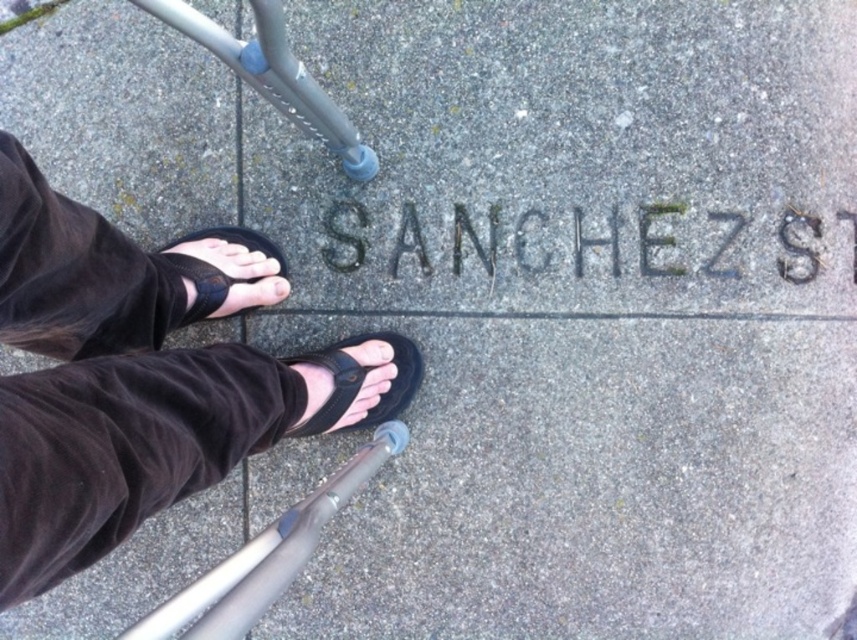
Which is behind, point (606, 216) or point (279, 291)?

The point (606, 216) is behind.

Is point (458, 237) farther from viewer compared to point (279, 278)?

Yes.

You are a GUI agent. You are given a task and a screenshot of the screen. Output one action in this format:
    pyautogui.click(x=<x>, y=<y>)
    Task: Click on the black textured lettering at center
    
    Given the screenshot: What is the action you would take?
    pyautogui.click(x=566, y=241)

Does black textured lettering at center have a greater width compared to black rubber sandal at center?

Correct, the width of black textured lettering at center exceeds that of black rubber sandal at center.

Consider the image. Who is shorter, black textured lettering at center or black rubber sandal at center?

black textured lettering at center

Does point (500, 218) lie behind point (358, 422)?

That is True.

In order to click on black textured lettering at center in this screenshot , I will do `click(566, 241)`.

Who is shorter, pinkish skin at center or white matte toe at center?

Standing shorter between the two is white matte toe at center.

Is point (267, 280) positioned before point (276, 289)?

Yes, it is.

What do you see at coordinates (270, 289) in the screenshot?
I see `pinkish skin at center` at bounding box center [270, 289].

Where is `pinkish skin at center`? The width and height of the screenshot is (857, 640). pinkish skin at center is located at coordinates (270, 289).